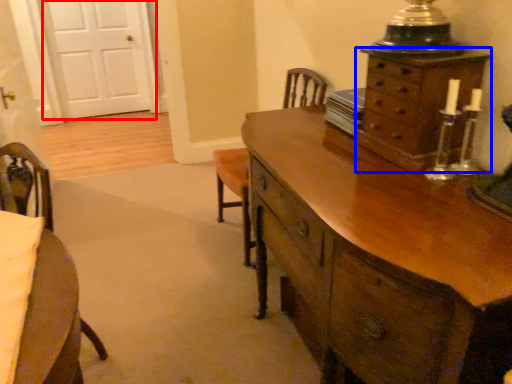
Question: Which object is further to the camera taking this photo, door (highlighted by a red box) or chest of drawers (highlighted by a blue box)?

Choices:
 (A) door
 (B) chest of drawers

Answer: (A)